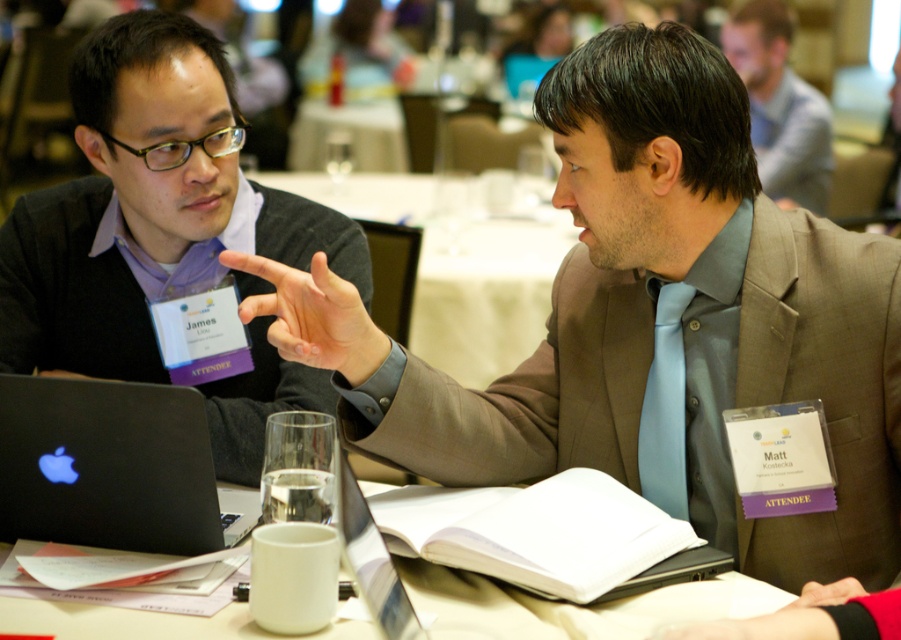
You are standing at the camera position and want to place a 3.5 feet long banner on the floor between you and the white matte table at center. Will the banner fit entirely on the floor without overlapping the table?

The distance between the camera and the white matte table at center is 3.46 feet, which is slightly less than the banner length of 3.5 feet. Therefore, the banner will not fit entirely and will overlap the table.

You are a photographer standing behind the table in the conference scene. You want to capture a closeup shot of both the matte black sweater at left and the light blue silk tie at center without any distortion. What is the minimum distance you should keep between the camera and the subjects to ensure both are in focus?

The minimum distance should be at least 33.27 inches to ensure both the matte black sweater at left and the light blue silk tie at center are in focus, as that is the distance between them.

You are a photographer preparing to take a group photo of the attendees at the conference table. You need to ensure that the white matte table at center and the light gray suit at upper right are both clearly visible in the frame. Considering their heights, which object should you position closer to the camera to avoid it being blocked by the other?

The white matte table at center is shorter than the light gray suit at upper right. To avoid the table being blocked, position the white matte table at center closer to the camera so it remains visible above the suit.